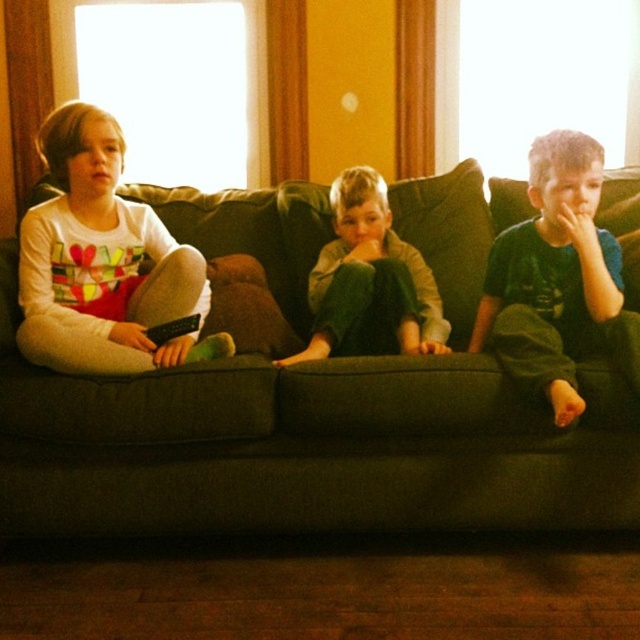
Is white soft shirt at left below green cotton pants at center?

No.

What do you see at coordinates (102, 262) in the screenshot?
I see `white soft shirt at left` at bounding box center [102, 262].

Is point (74, 177) positioned behind point (397, 243)?

No.

Where is `white soft shirt at left`? Image resolution: width=640 pixels, height=640 pixels. white soft shirt at left is located at coordinates (102, 262).

Does point (144, 424) come in front of point (525, 364)?

Yes, it is.

I want to click on green fabric couch at center, so click(305, 448).

Which is below, white soft shirt at left or green cotton shirt at right?

green cotton shirt at right is below.

Does white soft shirt at left appear on the right side of green cotton shirt at right?

In fact, white soft shirt at left is to the left of green cotton shirt at right.

Between point (17, 336) and point (561, 156), which one is positioned behind?

Positioned behind is point (561, 156).

Locate an element on the screen. white soft shirt at left is located at coordinates (102, 262).